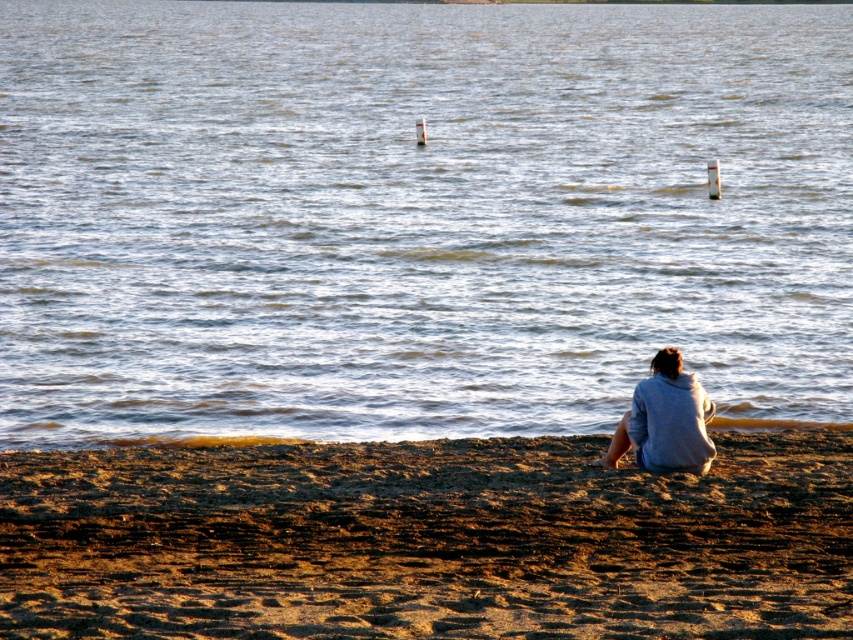
Does clear water at center appear on the left side of gray hoodie at lower right?

Correct, you'll find clear water at center to the left of gray hoodie at lower right.

Which is behind, point (125, 225) or point (671, 449)?

The point (125, 225) is more distant.

Between point (308, 186) and point (643, 381), which one is positioned behind?

The point (308, 186) is more distant.

Where is `clear water at center`? The width and height of the screenshot is (853, 640). clear water at center is located at coordinates (416, 216).

Is brown sandy beach at lower center thinner than gray hoodie at lower right?

No, brown sandy beach at lower center is not thinner than gray hoodie at lower right.

Between point (235, 484) and point (631, 424), which one is positioned in front?

Positioned in front is point (235, 484).

I want to click on brown sandy beach at lower center, so click(x=427, y=540).

Does clear water at center appear on the right side of brown sandy beach at lower center?

No, clear water at center is not to the right of brown sandy beach at lower center.

Between clear water at center and brown sandy beach at lower center, which one has more height?

clear water at center is taller.

At what (x,y) coordinates should I click in order to perform the action: click on clear water at center. Please return your answer as a coordinate pair (x, y). Looking at the image, I should click on (416, 216).